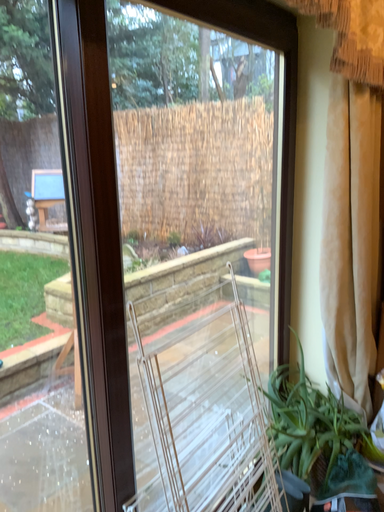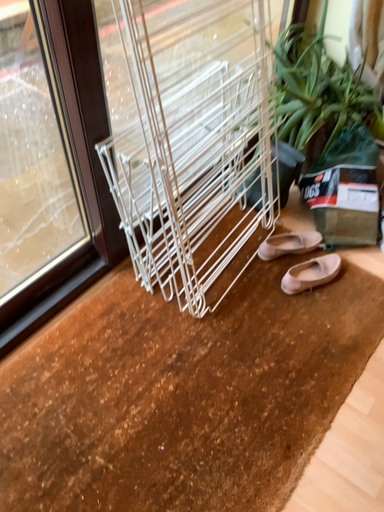
Question: Which way did the camera rotate in the video?

Choices:
 (A) rotated upward
 (B) rotated downward

Answer: (B)